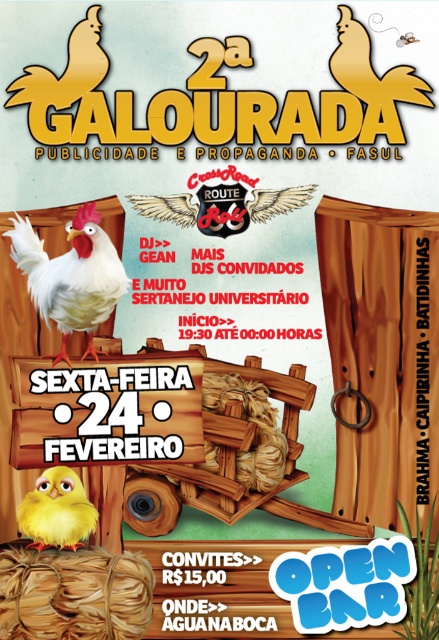
Who is positioned more to the left, white matte chicken at center or yellow matte chick at lower left?

yellow matte chick at lower left is more to the left.

Is point (31, 284) farther from viewer compared to point (67, 531)?

Yes.

Where is `white matte chicken at center`? The height and width of the screenshot is (640, 439). white matte chicken at center is located at coordinates (71, 275).